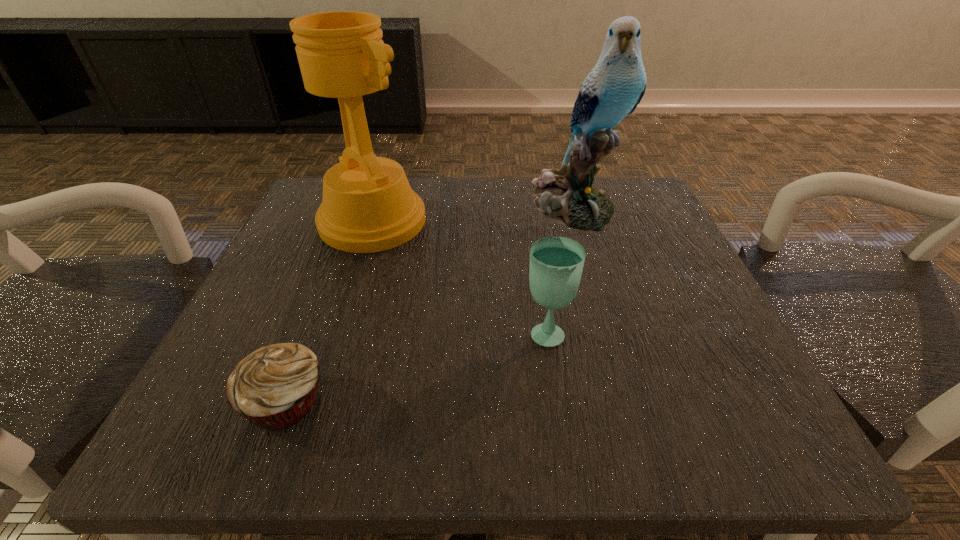
Image resolution: width=960 pixels, height=540 pixels. I want to click on vacant space that's between the second shortest object and the shortest object, so click(x=416, y=366).

Identify the location of free space between the third tallest object and the shortest object. (416, 366).

I want to click on vacant space that is in between the glass and the muffin, so click(x=416, y=366).

I want to click on vacant space that's between the parakeet and the muffin, so click(429, 304).

Identify which object is the third nearest to the shortest object. Please provide its 2D coordinates. Your answer should be formatted as a tuple, i.e. [(x, y)], where the tuple contains the x and y coordinates of a point satisfying the conditions above.

[(615, 86)]

Point out which object is positioned as the third nearest to the parakeet. Please provide its 2D coordinates. Your answer should be formatted as a tuple, i.e. [(x, y)], where the tuple contains the x and y coordinates of a point satisfying the conditions above.

[(274, 387)]

Identify the location of vacant point that satisfies the following two spatial constraints: 1. on the back side of the shortest object; 2. on the right side of the award. The image size is (960, 540). (353, 221).

Locate an element on the screen. The image size is (960, 540). vacant space that satisfies the following two spatial constraints: 1. on the front side of the second shortest object; 2. on the left side of the award is located at coordinates (337, 331).